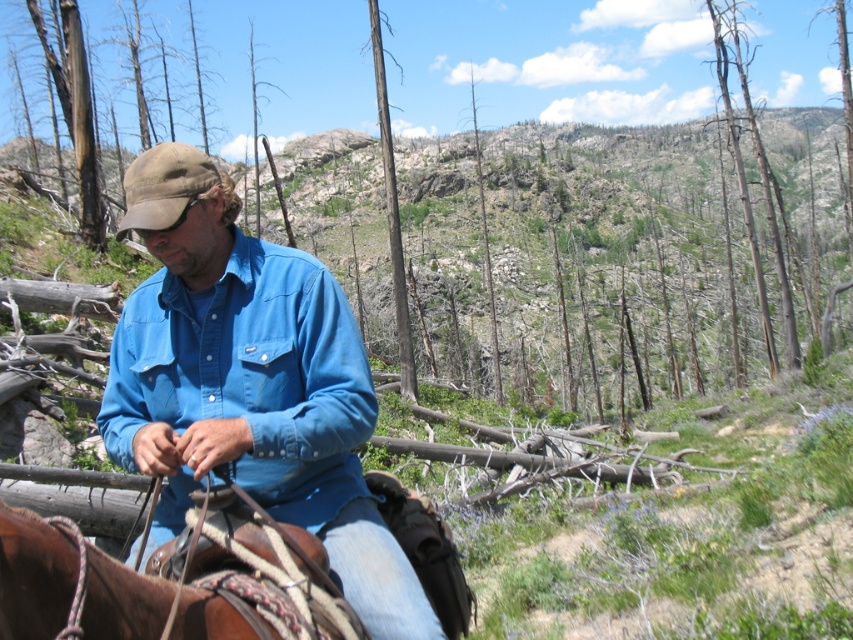
Question: Which object is the closest to the matte blue shirt at center?

Choices:
 (A) brown leather saddle at lower left
 (B) dead wood at upper right
 (C) brown rough bark tree at center
 (D) dead wood at center

Answer: (A)

Question: Is brown leather saddle at lower left to the right of dead wood at upper right from the viewer's perspective?

Choices:
 (A) yes
 (B) no

Answer: (B)

Question: Can you confirm if dead wood at upper right is thinner than dead wood at center?

Choices:
 (A) no
 (B) yes

Answer: (A)

Question: Which object is positioned closest to the dead wood at upper right?

Choices:
 (A) dead wood at center
 (B) matte blue shirt at center

Answer: (A)

Question: Does brown rough bark tree at center appear on the left side of dead wood at center?

Choices:
 (A) no
 (B) yes

Answer: (B)

Question: Which point appears farthest from the camera in this image?

Choices:
 (A) (306, 348)
 (B) (494, 332)

Answer: (B)